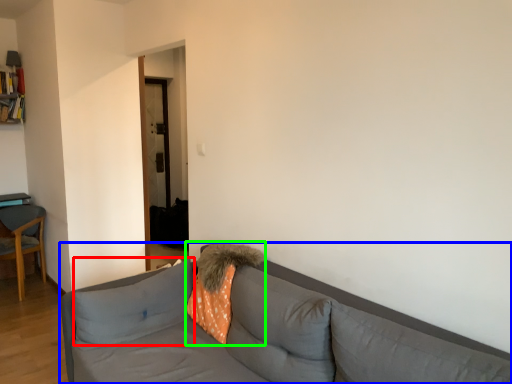
Question: Which is farther away from pillow (highlighted by a red box)? studio couch (highlighted by a blue box) or throw pillow (highlighted by a green box)?

Choices:
 (A) studio couch
 (B) throw pillow

Answer: (B)